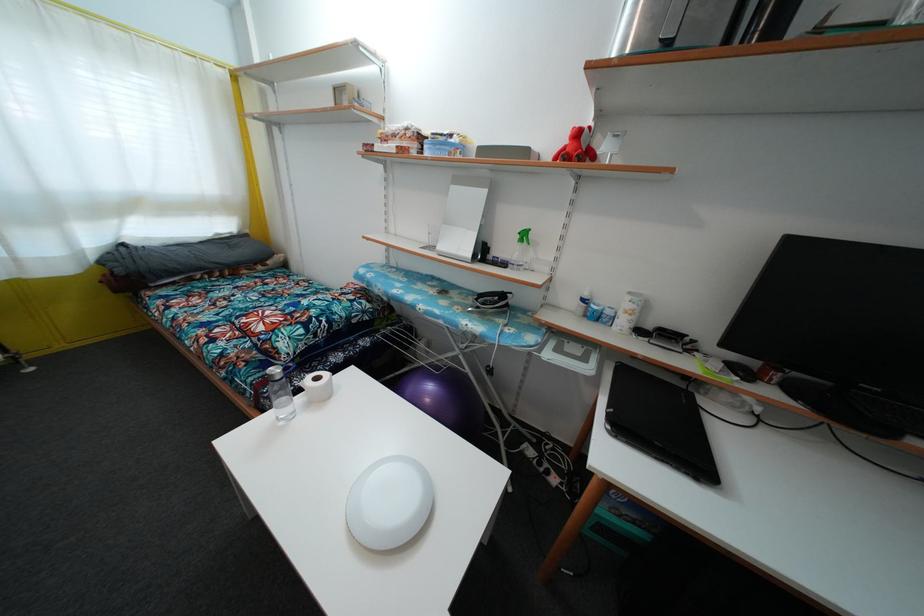
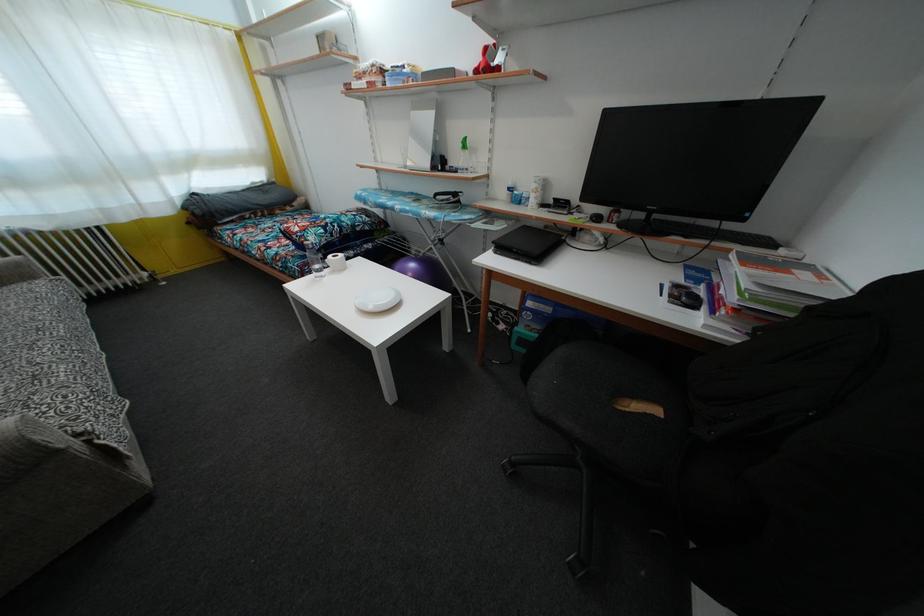
In the second image, find the point that corresponds to the point at 330,381 in the first image.

(345, 262)